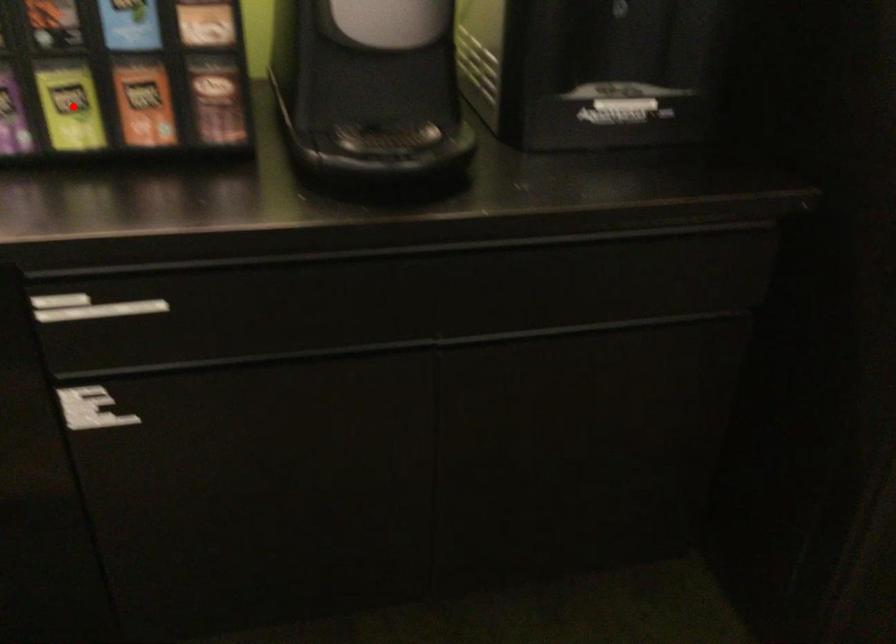
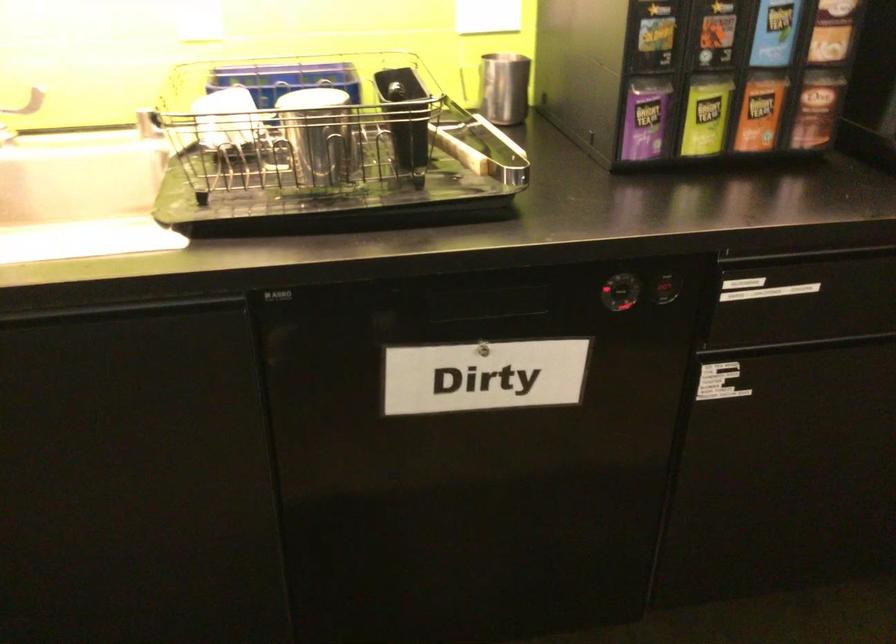
Question: I am providing you with two images of the same scene from different viewpoints. A red point is shown in image1. For the corresponding object point in image2, is it positioned nearer or farther from the camera?

Choices:
 (A) Nearer
 (B) Farther

Answer: (B)